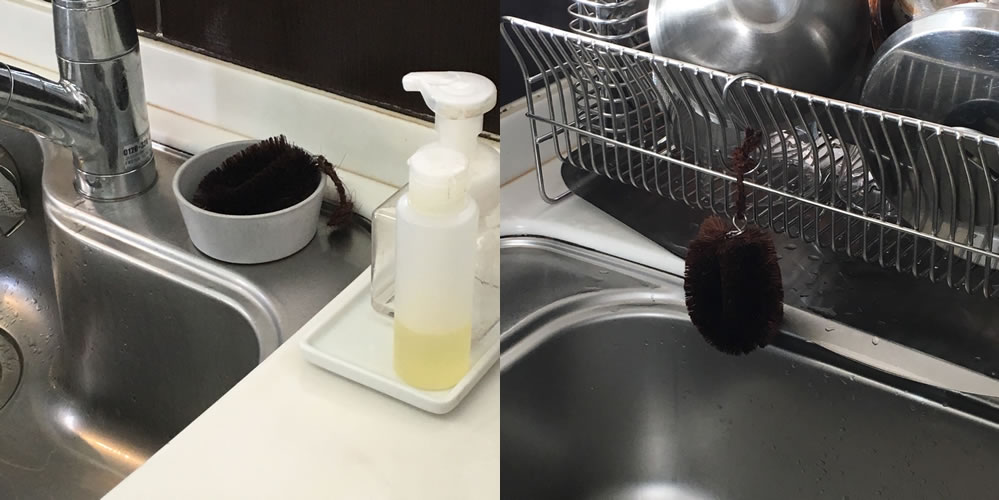
Image resolution: width=999 pixels, height=500 pixels. Find the location of `bowl`. bowl is located at coordinates (255, 231).